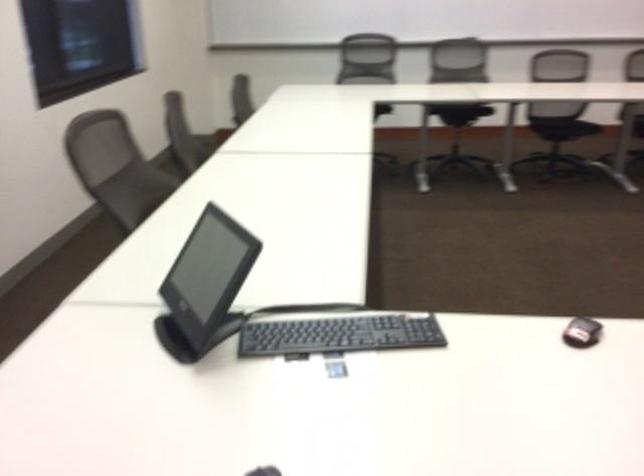
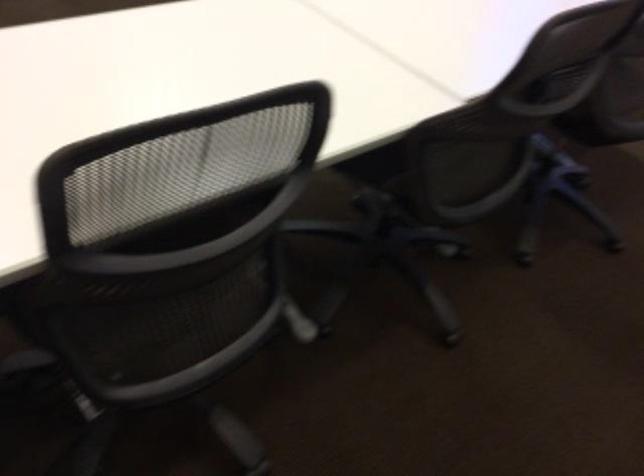
The first image is from the beginning of the video and the second image is from the end. How did the camera likely rotate when shooting the video?

The camera rotated toward right-down.